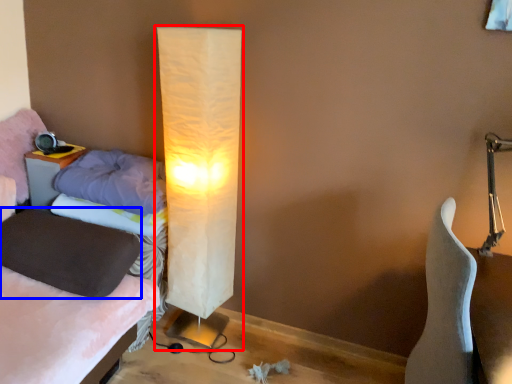
Question: Among these objects, which one is farthest to the camera, lamp (highlighted by a red box) or pillow (highlighted by a blue box)?

Choices:
 (A) lamp
 (B) pillow

Answer: (B)